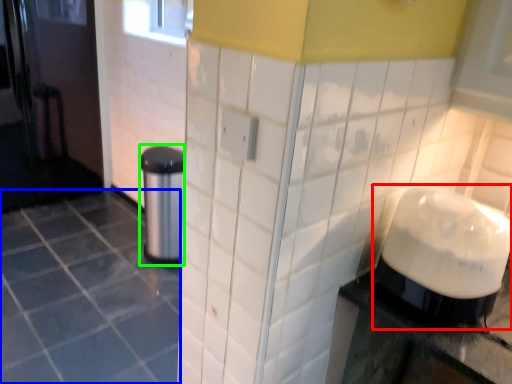
Question: Which object is the closest to the blender (highlighted by a red box)? Choose among these: ceramic tile (highlighted by a blue box) or appliance (highlighted by a green box).

Choices:
 (A) ceramic tile
 (B) appliance

Answer: (A)